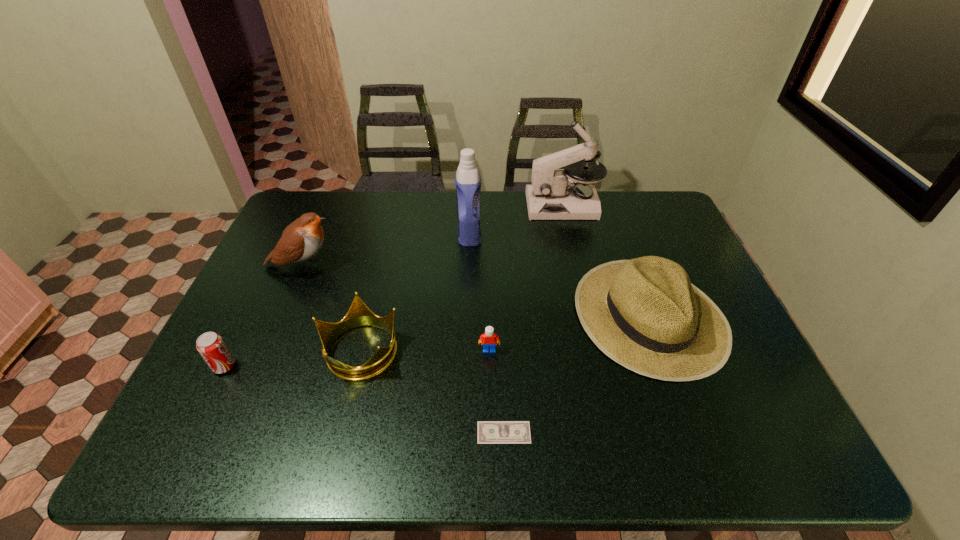
Find the location of a particular element. Image resolution: width=960 pixels, height=540 pixels. detergent that is at the far edge is located at coordinates (468, 183).

I want to click on object at the near edge, so click(x=488, y=432).

Locate an element on the screen. bird located at the left edge is located at coordinates (302, 239).

At what (x,y) coordinates should I click in order to perform the action: click on soda can that is at the left edge. Please return your answer as a coordinate pair (x, y). This screenshot has width=960, height=540. Looking at the image, I should click on (211, 346).

Locate an element on the screen. The image size is (960, 540). object that is positioned at the right edge is located at coordinates (645, 314).

In the image, there is a desktop. Where is `vacant space at the far edge`? vacant space at the far edge is located at coordinates pyautogui.click(x=406, y=191).

This screenshot has height=540, width=960. What are the coordinates of `free space at the near edge of the desktop` in the screenshot? It's located at (632, 455).

This screenshot has height=540, width=960. Identify the location of free space at the far left corner of the desktop. (298, 213).

At what (x,y) coordinates should I click in order to perform the action: click on empty space that is in between the detergent and the crown. Please return your answer as a coordinate pair (x, y). The height and width of the screenshot is (540, 960). Looking at the image, I should click on (415, 291).

Where is `unoccupied position between the nearest object and the Lego`? unoccupied position between the nearest object and the Lego is located at coordinates tap(496, 392).